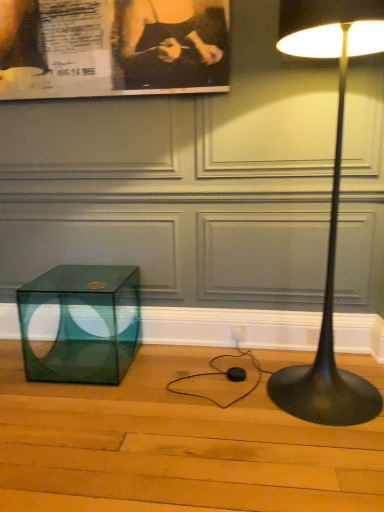
What do you see at coordinates (80, 323) in the screenshot? The image size is (384, 512). I see `transparent glass cube at lower left` at bounding box center [80, 323].

Find the location of a particular element. black paper at upper left is located at coordinates (113, 47).

Choose the correct answer: Is black matte floor lamp at right inside black paper at upper left or outside it?

The correct answer is: outside.

Does black matte floor lamp at right turn towards black paper at upper left?

No, black matte floor lamp at right is not aimed at black paper at upper left.

Find the location of a particular element. This screenshot has height=512, width=384. poster page located behind the black matte floor lamp at right is located at coordinates (113, 47).

What's the angular difference between black matte floor lamp at right and black paper at upper left's facing directions?

The facing directions of black matte floor lamp at right and black paper at upper left are 0.287 degrees apart.

Is transparent glass cube at lower left looking in the opposite direction of black paper at upper left?

No, transparent glass cube at lower left is not facing the opposite direction of black paper at upper left.

From a real-world perspective, is transparent glass cube at lower left above or below black paper at upper left?

transparent glass cube at lower left is situated lower than black paper at upper left in the real world.

Is point (21, 290) in front of point (164, 72)?

No.

In terms of size, does transparent glass cube at lower left appear bigger or smaller than black paper at upper left?

In the image, transparent glass cube at lower left appears to be larger than black paper at upper left.

Is transparent glass cube at lower left with black matte floor lamp at right?

transparent glass cube at lower left and black matte floor lamp at right are not in contact.

From a real-world perspective, is transparent glass cube at lower left physically below black matte floor lamp at right?

Indeed, from a real-world perspective, transparent glass cube at lower left is positioned beneath black matte floor lamp at right.

How many degrees apart are the facing directions of transparent glass cube at lower left and black matte floor lamp at right?

They differ by 0.186 degrees in their facing directions.

From the image's perspective, which is below, black paper at upper left or black matte floor lamp at right?

black matte floor lamp at right is shown below in the image.

In the scene shown: How many degrees apart are the facing directions of black paper at upper left and black matte floor lamp at right?

0.287 degrees.

Measure the distance from black paper at upper left to black matte floor lamp at right.

They are 33.74 inches apart.

Which is in front, black paper at upper left or black matte floor lamp at right?

black matte floor lamp at right is closer to the camera.

Does black matte floor lamp at right lie in front of transparent glass cube at lower left?

Yes, black matte floor lamp at right is closer to the viewer.

Is black matte floor lamp at right directly adjacent to transparent glass cube at lower left?

No, black matte floor lamp at right is not beside transparent glass cube at lower left.

Could you tell me if black matte floor lamp at right is facing transparent glass cube at lower left?

No, black matte floor lamp at right is not oriented towards transparent glass cube at lower left.

Which is closer, (327, 419) or (91, 345)?

Clearly, point (327, 419) is closer to the camera than point (91, 345).

From a real-world perspective, between black paper at upper left and transparent glass cube at lower left, who is vertically lower?

transparent glass cube at lower left is physically lower.

Identify the location of table that appears below the black paper at upper left (from a real-world perspective). (80, 323).

Does black paper at upper left appear on the right side of transparent glass cube at lower left?

Yes, black paper at upper left is to the right of transparent glass cube at lower left.

Is transparent glass cube at lower left a part of black paper at upper left?

No, transparent glass cube at lower left is located outside of black paper at upper left.

Where is `poster page on the left of black matte floor lamp at right`? The height and width of the screenshot is (512, 384). poster page on the left of black matte floor lamp at right is located at coordinates (113, 47).

Where is `table in front of the black paper at upper left`? The image size is (384, 512). table in front of the black paper at upper left is located at coordinates (80, 323).

Based on their spatial positions, is black paper at upper left or black matte floor lamp at right further from transparent glass cube at lower left?

black matte floor lamp at right is further to transparent glass cube at lower left.

From the image, which object appears to be nearer to black paper at upper left, transparent glass cube at lower left or black matte floor lamp at right?

The object closer to black paper at upper left is black matte floor lamp at right.

Looking at the image, which one is located closer to black matte floor lamp at right, black paper at upper left or transparent glass cube at lower left?

black paper at upper left lies closer to black matte floor lamp at right than the other object.

Which object lies further to the anchor point black paper at upper left, black matte floor lamp at right or transparent glass cube at lower left?

transparent glass cube at lower left lies further to black paper at upper left than the other object.

Estimate the real-world distances between objects in this image. Which object is closer to transparent glass cube at lower left, black matte floor lamp at right or black paper at upper left?

black paper at upper left lies closer to transparent glass cube at lower left than the other object.

Based on their spatial positions, is transparent glass cube at lower left or black paper at upper left closer to black matte floor lamp at right?

black paper at upper left is closer to black matte floor lamp at right.

At what (x,y) coordinates should I click in order to perform the action: click on lamp between black paper at upper left and transparent glass cube at lower left in the vertical direction. Please return your answer as a coordinate pair (x, y). The image size is (384, 512). Looking at the image, I should click on click(x=331, y=210).